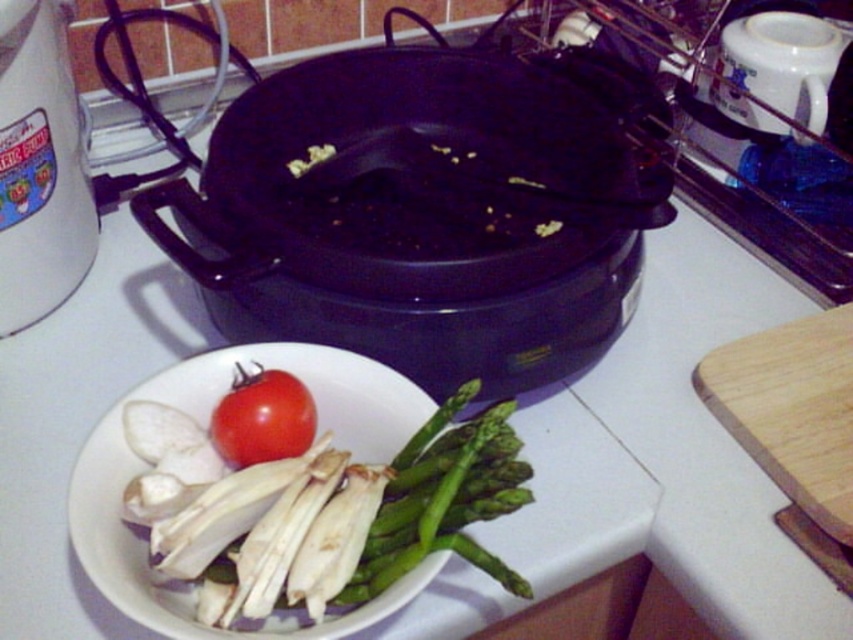
Does white glossy bowl at lower left appear over white plastic kettle at lower left?

Actually, white glossy bowl at lower left is below white plastic kettle at lower left.

Find the location of a particular element. white glossy bowl at lower left is located at coordinates (204, 424).

Identify the location of white glossy bowl at lower left. (204, 424).

Is white glossy bowl at lower left thinner than glossy red tomato at center?

Incorrect, white glossy bowl at lower left's width is not less than glossy red tomato at center's.

Is white glossy bowl at lower left closer to the viewer compared to glossy red tomato at center?

Yes, it is in front of glossy red tomato at center.

What are the coordinates of `white glossy bowl at lower left` in the screenshot? It's located at (204, 424).

Is point (51, 268) positioned behind point (268, 429)?

That is True.

Find the location of a particular element. The width and height of the screenshot is (853, 640). white plastic kettle at lower left is located at coordinates (39, 164).

Describe the element at coordinates (39, 164) in the screenshot. I see `white plastic kettle at lower left` at that location.

The height and width of the screenshot is (640, 853). I want to click on white plastic kettle at lower left, so click(x=39, y=164).